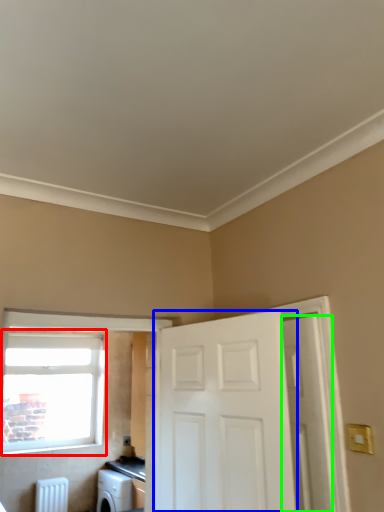
Question: Based on their relative distances, which object is farther from window (highlighted by a red box)? Choose from door (highlighted by a blue box) and door (highlighted by a green box).

Choices:
 (A) door
 (B) door

Answer: (B)